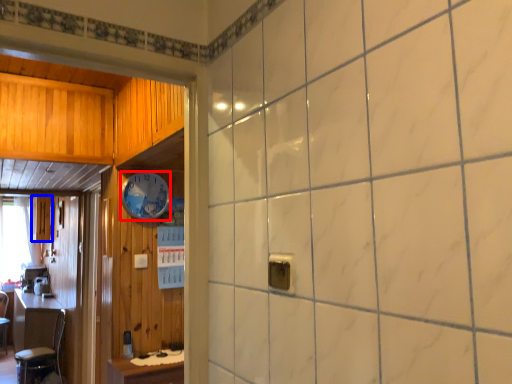
Question: Which object appears closest to the camera in this image, clock (highlighted by a red box) or cabinetry (highlighted by a blue box)?

Choices:
 (A) clock
 (B) cabinetry

Answer: (A)